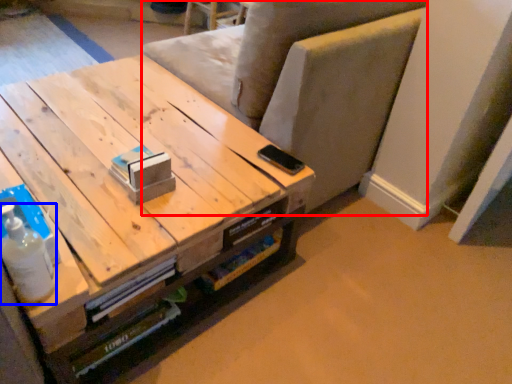
Question: Which object appears closest to the camera in this image, armchair (highlighted by a red box) or bottle (highlighted by a blue box)?

Choices:
 (A) armchair
 (B) bottle

Answer: (B)